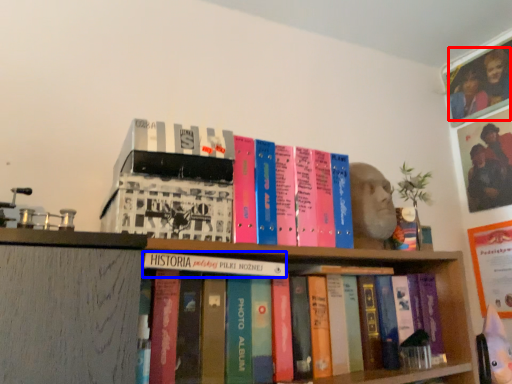
Question: Which point is further to the camera, couple (highlighted by a red box) or book (highlighted by a blue box)?

Choices:
 (A) couple
 (B) book

Answer: (A)